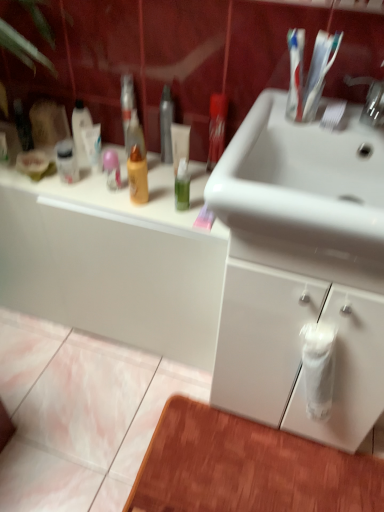
Question: From the image's perspective, is white glossy cabinet at lower left, which is counted as the second bathroom cabinet, starting from the right, located above or below white glossy cabinet at lower right, placed as the 1th bathroom cabinet when sorted from right to left?

Choices:
 (A) above
 (B) below

Answer: (A)

Question: In terms of width, does white glossy cabinet at lower left, which is counted as the second bathroom cabinet, starting from the right, look wider or thinner when compared to white glossy cabinet at lower right, arranged as the second bathroom cabinet when viewed from the left?

Choices:
 (A) wide
 (B) thin

Answer: (B)

Question: Which is nearer to the white glossy cabinet at lower left, which is counted as the second bathroom cabinet, starting from the right?

Choices:
 (A) white glossy sink at upper center
 (B) white glossy cabinet at lower right, arranged as the second bathroom cabinet when viewed from the left

Answer: (B)

Question: Which object is positioned closest to the white glossy cabinet at lower right, placed as the 1th bathroom cabinet when sorted from right to left?

Choices:
 (A) white glossy sink at upper center
 (B) white glossy cabinet at lower left, arranged as the 1th bathroom cabinet when viewed from the left

Answer: (A)